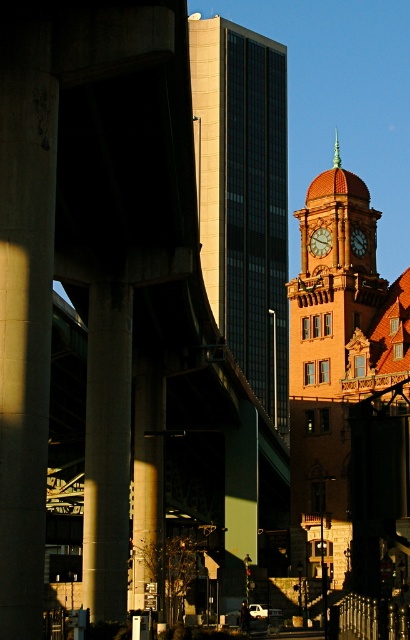
You are a construction worker assessing the stability of the pillars in the scene. Given that the concrete pillar at left and the concrete pillar at center are both supporting the structure, which pillar might require additional reinforcement based on their thickness?

The concrete pillar at left is thinner than the concrete pillar at center, so it might require additional reinforcement due to its smaller diameter.

You are an architect analyzing the urban scene. You observe the matte gold clock at center and the gold textured clock at center. Which clock is positioned further away from the viewer?

The gold textured clock at center is positioned further away from the viewer, as it is described as being behind the matte gold clock at center.